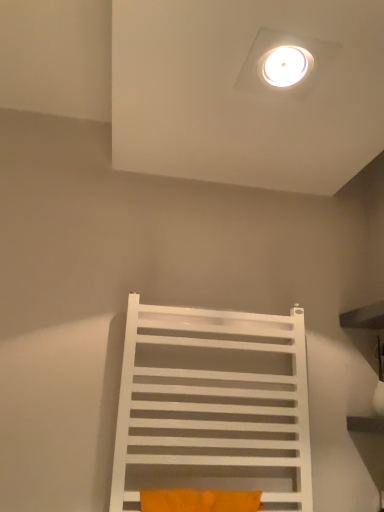
Question: Can you confirm if orange fabric pillow at lower center is thinner than white matte towel rack at center?

Choices:
 (A) yes
 (B) no

Answer: (A)

Question: Considering the relative sizes of orange fabric pillow at lower center and white matte towel rack at center in the image provided, is orange fabric pillow at lower center shorter than white matte towel rack at center?

Choices:
 (A) no
 (B) yes

Answer: (B)

Question: Is orange fabric pillow at lower center behind white matte towel rack at center?

Choices:
 (A) yes
 (B) no

Answer: (B)

Question: Is orange fabric pillow at lower center wider than white matte towel rack at center?

Choices:
 (A) no
 (B) yes

Answer: (A)

Question: From a real-world perspective, is orange fabric pillow at lower center positioned under white matte towel rack at center based on gravity?

Choices:
 (A) yes
 (B) no

Answer: (A)

Question: Considering the relative positions of orange fabric pillow at lower center and white matte towel rack at center in the image provided, is orange fabric pillow at lower center to the right of white matte towel rack at center from the viewer's perspective?

Choices:
 (A) yes
 (B) no

Answer: (A)

Question: Is white matte towel rack at center to the right of orange fabric pillow at lower center from the viewer's perspective?

Choices:
 (A) no
 (B) yes

Answer: (A)

Question: Is the position of white matte towel rack at center more distant than that of orange fabric pillow at lower center?

Choices:
 (A) no
 (B) yes

Answer: (B)

Question: From a real-world perspective, is white matte towel rack at center positioned under orange fabric pillow at lower center based on gravity?

Choices:
 (A) no
 (B) yes

Answer: (A)

Question: Is white matte towel rack at center positioned in front of orange fabric pillow at lower center?

Choices:
 (A) no
 (B) yes

Answer: (A)

Question: Can you confirm if white matte towel rack at center is positioned to the left of orange fabric pillow at lower center?

Choices:
 (A) yes
 (B) no

Answer: (A)

Question: Is white matte towel rack at center shorter than orange fabric pillow at lower center?

Choices:
 (A) yes
 (B) no

Answer: (B)

Question: From the image's perspective, is orange fabric pillow at lower center located above or below white matte towel rack at center?

Choices:
 (A) below
 (B) above

Answer: (A)